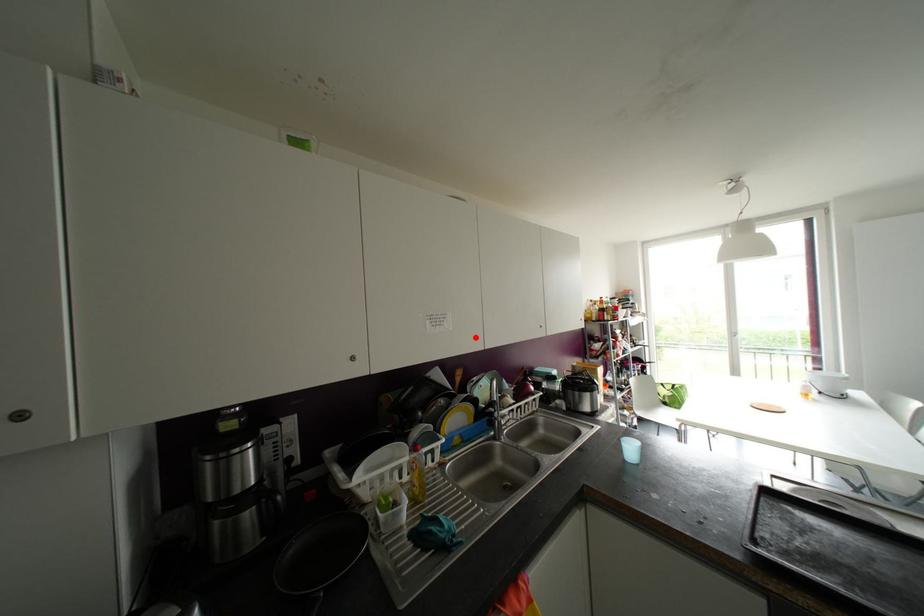
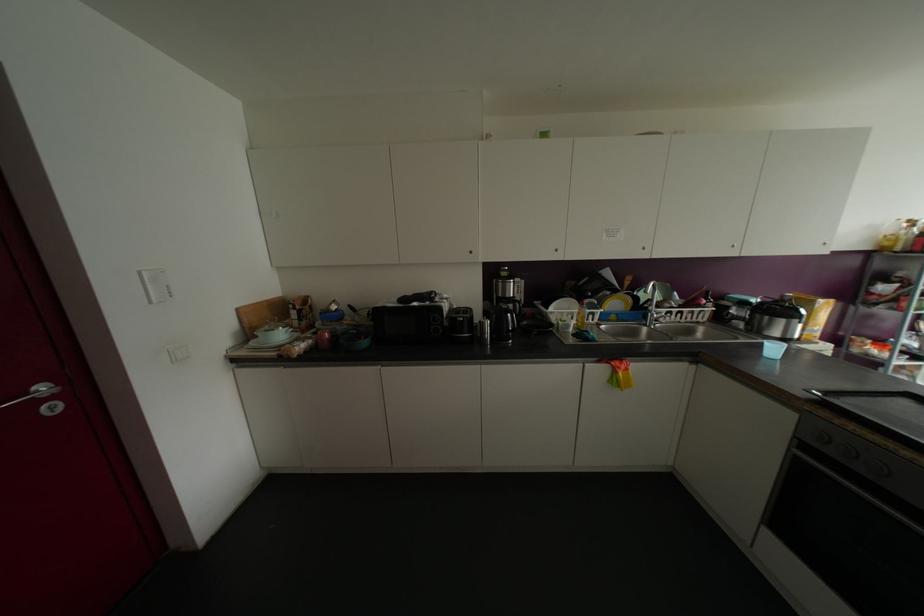
In the second image, find the point that corresponds to the highlighted location in the first image.

(642, 248)